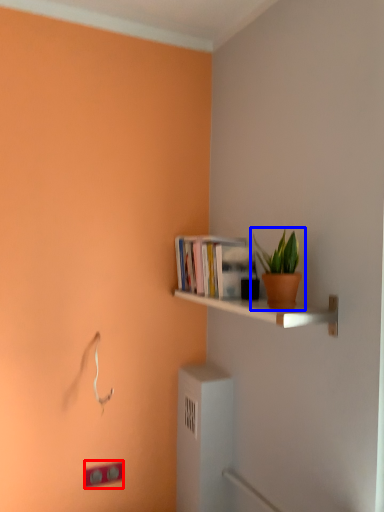
Question: Which object appears closest to the camera in this image, light switch (highlighted by a red box) or houseplant (highlighted by a blue box)?

Choices:
 (A) light switch
 (B) houseplant

Answer: (B)